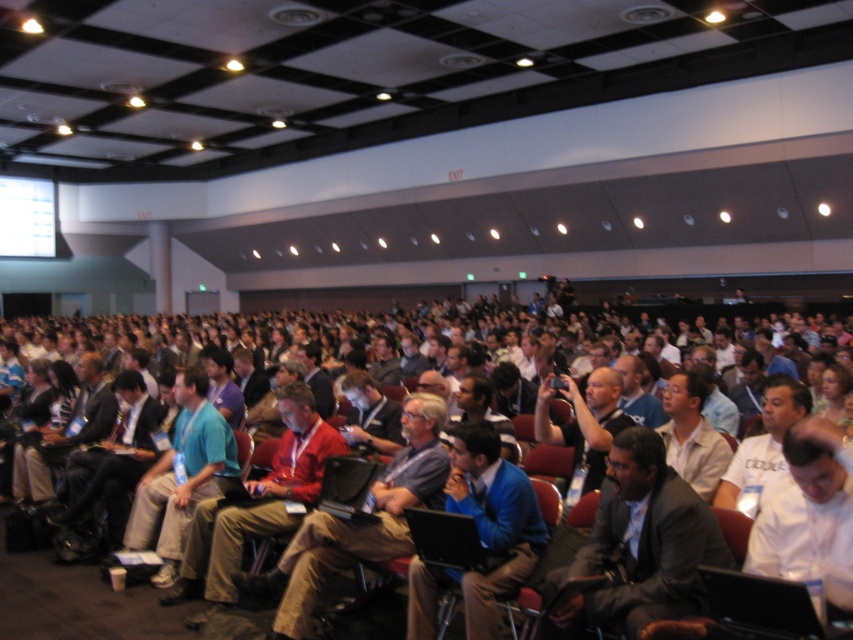
You are standing at the front of the conference room and want to check if the point at coordinates point (672, 598) is within a safe distance for a presenter to walk to without obstructing the audience. The safe distance is set to 8 feet. Is the point within the safe distance?

The distance of point (672, 598) from camera is 8.47 feet, which is slightly beyond the 8 feet safe distance. Therefore, the presenter should avoid walking to that point to prevent obstructing the audience.

You are sitting in the front row of the conference and notice two individuals in the center of the room. One is wearing a dark gray suit at center and the other a blue fabric shirt at center. From your perspective, which person is positioned to the right?

The dark gray suit at center is to the right of the blue fabric shirt at center, so the person in the dark gray suit at center is positioned to the right.

You are organizing a photo shoot and need to position two models wearing the dark gray suit at center and the red fabric shirt at center. Since the room has limited space, you want to ensure they can stand side by side without overlapping. Based on their widths, which model should you place on the side to minimize the total space needed?

The dark gray suit at center has a lesser width compared to the red fabric shirt at center. To minimize the total space needed, place the wider red fabric shirt at center in the middle and the narrower dark gray suit at center on either side, as this arrangement requires less overall space.